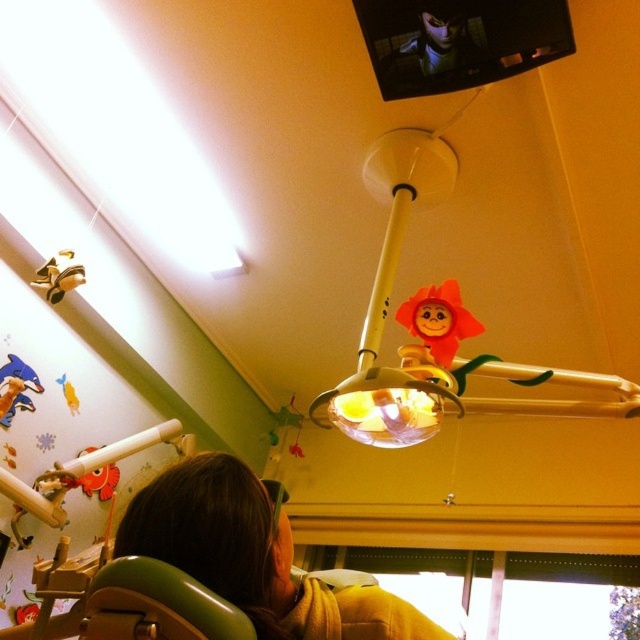
Based on the photo, you are a child sitting in the dental chair and looking up. You see the green plastic chair at lower left and the metallic ring at upper center. Which object is closer to your right side?

The green plastic chair at lower left is positioned on the right side of metallic ring at upper center, so it is closer to your right side.

Based on the photo, you are sitting in the dental chair and want to place a small toy on the brown fabric at lower center. To ensure it stays in place, where should you place it relative to the dental light fixture?

The brown fabric at lower center is located at point (257, 556), so placing the toy near that coordinate will ensure it stays in place relative to the dental light fixture.

You are a child sitting in the dental chair and want to grab the brown fabric at lower center and the matte plastic doll at center. Which object is closer to your right hand?

The matte plastic doll at center is closer to your right hand because the brown fabric at lower center is positioned on the left side of it.